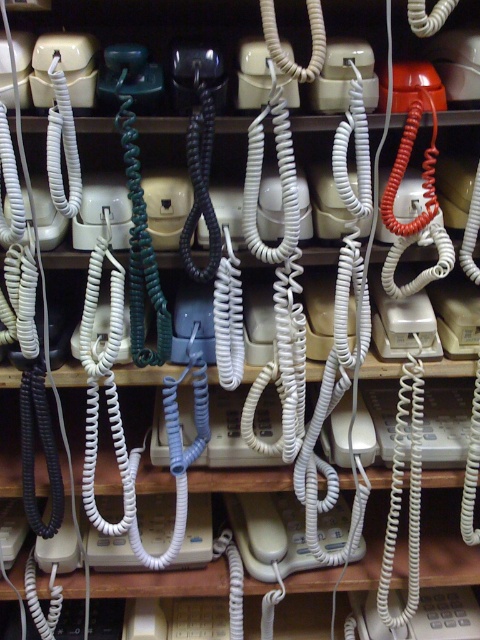
Between white matte phone at center and white matte telephone at center, which one is positioned lower?

white matte telephone at center

Does white matte phone at center have a larger size compared to white matte telephone at center?

Correct, white matte phone at center is larger in size than white matte telephone at center.

Which is in front, point (344, 516) or point (474, 600)?

Point (344, 516) is more forward.

At what (x,y) coordinates should I click in order to perform the action: click on white matte phone at center. Please return your answer as a coordinate pair (x, y). Looking at the image, I should click on (269, 532).